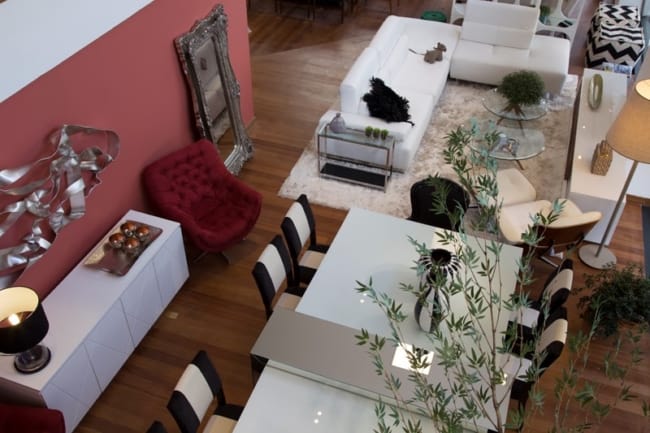
Where is `white wall`? This screenshot has height=433, width=650. white wall is located at coordinates (73, 17).